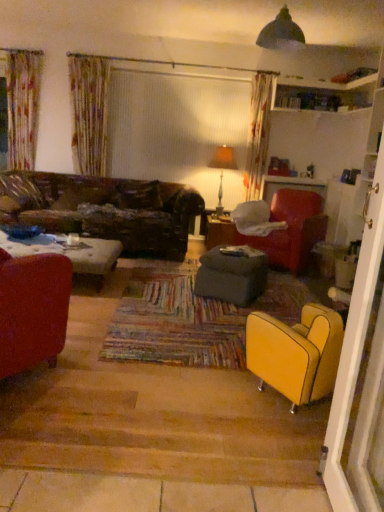
Question: Is point [261, 282] positioned closer to the camera than point [221, 224]?

Choices:
 (A) farther
 (B) closer

Answer: (B)

Question: In the image, is dark gray fabric ottoman at center on the left side or the right side of matte brown table at center?

Choices:
 (A) left
 (B) right

Answer: (A)

Question: Estimate the real-world distances between objects in this image. Which object is closer to the matte red armchair at left, the first chair when ordered from left to right?

Choices:
 (A) yellow leather armchair at lower right, which is the 2th chair in left-to-right order
 (B) matte brown table at center
 (C) velvet red armchair at center-right, which is the third chair from front to back
 (D) dark gray fabric ottoman at center
 (E) matte orange lampshade at upper center

Answer: (A)

Question: Considering the real-world distances, which object is farthest from the matte brown table at center?

Choices:
 (A) dark gray fabric ottoman at center
 (B) yellow leather armchair at lower right, which appears as the second chair when viewed from the front
 (C) matte red armchair at left, positioned as the first chair in front-to-back order
 (D) velvet red armchair at center-right, the third chair in the left-to-right sequence
 (E) matte orange lampshade at upper center

Answer: (C)